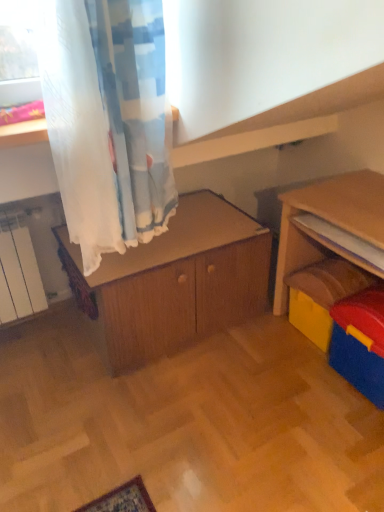
Question: Is wooden cabinet at center thinner than yellow plastic toy at right?

Choices:
 (A) yes
 (B) no

Answer: (B)

Question: Can you confirm if wooden cabinet at center is bigger than yellow plastic toy at right?

Choices:
 (A) no
 (B) yes

Answer: (B)

Question: From the image's perspective, is wooden cabinet at center on yellow plastic toy at right?

Choices:
 (A) yes
 (B) no

Answer: (A)

Question: Is wooden cabinet at center further to camera compared to yellow plastic toy at right?

Choices:
 (A) yes
 (B) no

Answer: (B)

Question: From a real-world perspective, does wooden cabinet at center sit lower than yellow plastic toy at right?

Choices:
 (A) yes
 (B) no

Answer: (B)

Question: Does wooden cabinet at center have a greater width compared to yellow plastic toy at right?

Choices:
 (A) no
 (B) yes

Answer: (B)

Question: Is wooden cabinet at center turned away from blue plastic storage box at lower right?

Choices:
 (A) no
 (B) yes

Answer: (A)

Question: Does wooden cabinet at center have a greater height compared to blue plastic storage box at lower right?

Choices:
 (A) yes
 (B) no

Answer: (A)

Question: Considering the relative sizes of wooden cabinet at center and blue plastic storage box at lower right in the image provided, is wooden cabinet at center smaller than blue plastic storage box at lower right?

Choices:
 (A) yes
 (B) no

Answer: (B)

Question: Is wooden cabinet at center outside blue plastic storage box at lower right?

Choices:
 (A) yes
 (B) no

Answer: (A)

Question: Considering the relative sizes of wooden cabinet at center and blue plastic storage box at lower right in the image provided, is wooden cabinet at center wider than blue plastic storage box at lower right?

Choices:
 (A) yes
 (B) no

Answer: (A)

Question: Is the position of wooden cabinet at center more distant than that of blue plastic storage box at lower right?

Choices:
 (A) yes
 (B) no

Answer: (A)

Question: Considering the relative sizes of yellow plastic toy at right and blue plastic storage box at lower right in the image provided, is yellow plastic toy at right thinner than blue plastic storage box at lower right?

Choices:
 (A) yes
 (B) no

Answer: (B)